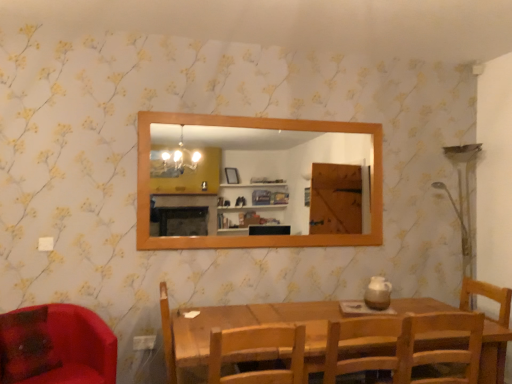
You are a GUI agent. You are given a task and a screenshot of the screen. Output one action in this format:
    pyautogui.click(x=<x>, y=<y>)
    Task: Click on the wooden chair at lower right, which is counted as the fourth chair, starting from the left
    
    Given the screenshot: What is the action you would take?
    pyautogui.click(x=439, y=350)

From the image's perspective, is wooden chair at center, arranged as the third chair when viewed from the right, above or below wooden chair at lower right, which is counted as the fourth chair, starting from the left?

wooden chair at center, arranged as the third chair when viewed from the right, is above wooden chair at lower right, which is counted as the fourth chair, starting from the left.

Are wooden chair at center, arranged as the third chair when viewed from the right, and wooden chair at lower right, which is counted as the fourth chair, starting from the left, making contact?

They are not placed beside each other.

Based on the photo, does wooden chair at center, arranged as the third chair when viewed from the right, have a smaller size compared to wooden chair at lower right, which is counted as the 1th chair, starting from the right?

Indeed, wooden chair at center, arranged as the third chair when viewed from the right, has a smaller size compared to wooden chair at lower right, which is counted as the 1th chair, starting from the right.

From a real-world perspective, is wooden chair at center, arranged as the third chair when viewed from the right, on wooden chair at lower right, which is counted as the fourth chair, starting from the left?

Yes, from a real-world perspective, wooden chair at center, arranged as the third chair when viewed from the right, is on top of wooden chair at lower right, which is counted as the fourth chair, starting from the left.

You are a GUI agent. You are given a task and a screenshot of the screen. Output one action in this format:
    pyautogui.click(x=<x>, y=<y>)
    Task: Click on the 1st chair to the left when counting from the wooden chair at lower right, which is counted as the 1th chair, starting from the right
    The image size is (512, 384).
    Given the screenshot: What is the action you would take?
    pyautogui.click(x=360, y=337)

From a real-world perspective, between wooden chair at center, arranged as the third chair when viewed from the left, and wooden chair at lower right, which is counted as the 1th chair, starting from the right, who is vertically lower?

wooden chair at lower right, which is counted as the 1th chair, starting from the right, from a real-world perspective.

Is the surface of wooden chair at center, arranged as the third chair when viewed from the left, in direct contact with wooden chair at lower right, which is counted as the fourth chair, starting from the left?

No, wooden chair at center, arranged as the third chair when viewed from the left, is not with wooden chair at lower right, which is counted as the fourth chair, starting from the left.

Considering the sizes of objects wooden chair at center, arranged as the 2th chair when viewed from the right, and wooden chair at lower right, which is counted as the fourth chair, starting from the left, in the image provided, who is thinner, wooden chair at center, arranged as the 2th chair when viewed from the right, or wooden chair at lower right, which is counted as the fourth chair, starting from the left,?

With smaller width is wooden chair at lower right, which is counted as the fourth chair, starting from the left.

From a real-world perspective, is wooden chair at lower right, which is counted as the fourth chair, starting from the left, physically located above or below wooden mirror at upper center?

wooden chair at lower right, which is counted as the fourth chair, starting from the left, is situated lower than wooden mirror at upper center in the real world.

Consider the image. Which object is further away from the camera taking this photo, wooden chair at lower right, which is counted as the fourth chair, starting from the left, or wooden mirror at upper center?

Positioned behind is wooden mirror at upper center.

From the image's perspective, who appears lower, wooden chair at center, arranged as the third chair when viewed from the right, or wooden chair at center, arranged as the 2th chair when viewed from the right?

wooden chair at center, arranged as the 2th chair when viewed from the right, appears lower in the image.

Does wooden chair at center, positioned as the second chair in left-to-right order, have a lesser height compared to wooden chair at center, arranged as the third chair when viewed from the left?

Indeed, wooden chair at center, positioned as the second chair in left-to-right order, has a lesser height compared to wooden chair at center, arranged as the third chair when viewed from the left.

Does wooden chair at center, positioned as the second chair in left-to-right order, have a greater width compared to wooden chair at center, arranged as the 2th chair when viewed from the right?

No, wooden chair at center, positioned as the second chair in left-to-right order, is not wider than wooden chair at center, arranged as the 2th chair when viewed from the right.

How many degrees apart are the facing directions of matte red chair at lower left, placed as the 1th chair when sorted from left to right, and wooden chair at center, positioned as the second chair in left-to-right order?

matte red chair at lower left, placed as the 1th chair when sorted from left to right, and wooden chair at center, positioned as the second chair in left-to-right order, are facing 160 degrees away from each other.

Are matte red chair at lower left, which appears as the fourth chair when viewed from the right, and wooden chair at center, arranged as the third chair when viewed from the right, far apart?

matte red chair at lower left, which appears as the fourth chair when viewed from the right, is positioned a significant distance from wooden chair at center, arranged as the third chair when viewed from the right.

Looking at this image, does matte red chair at lower left, placed as the 1th chair when sorted from left to right, have a greater width compared to wooden chair at center, positioned as the second chair in left-to-right order?

Correct, the width of matte red chair at lower left, placed as the 1th chair when sorted from left to right, exceeds that of wooden chair at center, positioned as the second chair in left-to-right order.

Does matte red chair at lower left, placed as the 1th chair when sorted from left to right, lie behind wooden chair at center, positioned as the second chair in left-to-right order?

Yes, matte red chair at lower left, placed as the 1th chair when sorted from left to right, is behind wooden chair at center, positioned as the second chair in left-to-right order.

Is matte red chair at lower left, which appears as the fourth chair when viewed from the right, next to wooden mirror at upper center and touching it?

No, matte red chair at lower left, which appears as the fourth chair when viewed from the right, is not touching wooden mirror at upper center.

Which is in front, matte red chair at lower left, which appears as the fourth chair when viewed from the right, or wooden mirror at upper center?

matte red chair at lower left, which appears as the fourth chair when viewed from the right, is in front.

Considering the sizes of objects matte red chair at lower left, placed as the 1th chair when sorted from left to right, and wooden mirror at upper center in the image provided, who is thinner, matte red chair at lower left, placed as the 1th chair when sorted from left to right, or wooden mirror at upper center?

Thinner between the two is wooden mirror at upper center.

Is wooden mirror at upper center in contact with wooden chair at center, arranged as the third chair when viewed from the left?

No, wooden mirror at upper center is not next to wooden chair at center, arranged as the third chair when viewed from the left.

From a real-world perspective, is wooden mirror at upper center above or below wooden chair at center, arranged as the third chair when viewed from the left?

From a real-world perspective, wooden mirror at upper center is physically above wooden chair at center, arranged as the third chair when viewed from the left.

Identify the location of the 3rd chair in front of the wooden mirror at upper center, starting your count from the anchor. (360, 337).

You are a GUI agent. You are given a task and a screenshot of the screen. Output one action in this format:
    pyautogui.click(x=<x>, y=<y>)
    Task: Click on the 2nd chair positioned above the wooden chair at lower right, which is counted as the fourth chair, starting from the left (from a real-world perspective)
    Image resolution: width=512 pixels, height=384 pixels.
    Given the screenshot: What is the action you would take?
    pyautogui.click(x=258, y=348)

Locate an element on the screen. The image size is (512, 384). chair on the right of wooden chair at center, arranged as the third chair when viewed from the left is located at coordinates (439, 350).

Based on their spatial positions, is matte red chair at lower left, which appears as the fourth chair when viewed from the right, or wooden chair at lower right, which is counted as the 1th chair, starting from the right, further from wooden chair at center, arranged as the third chair when viewed from the left?

Among the two, matte red chair at lower left, which appears as the fourth chair when viewed from the right, is located further to wooden chair at center, arranged as the third chair when viewed from the left.

Consider the image. From the image, which object appears to be farther from wooden chair at center, arranged as the third chair when viewed from the right, wooden mirror at upper center or matte red chair at lower left, which appears as the fourth chair when viewed from the right?

wooden mirror at upper center.

From the picture: Looking at the image, which one is located closer to wooden chair at lower right, which is counted as the fourth chair, starting from the left, wooden chair at center, positioned as the second chair in left-to-right order, or wooden mirror at upper center?

The object closer to wooden chair at lower right, which is counted as the fourth chair, starting from the left, is wooden chair at center, positioned as the second chair in left-to-right order.

Which object lies nearer to the anchor point matte red chair at lower left, placed as the 1th chair when sorted from left to right, wooden chair at center, arranged as the 2th chair when viewed from the right, or wooden chair at lower right, which is counted as the 1th chair, starting from the right?

wooden chair at center, arranged as the 2th chair when viewed from the right, is closer to matte red chair at lower left, placed as the 1th chair when sorted from left to right.

Estimate the real-world distances between objects in this image. Which object is closer to wooden chair at center, arranged as the 2th chair when viewed from the right, wooden chair at center, arranged as the third chair when viewed from the right, or wooden chair at lower right, which is counted as the 1th chair, starting from the right?

wooden chair at lower right, which is counted as the 1th chair, starting from the right, is closer to wooden chair at center, arranged as the 2th chair when viewed from the right.

From the image, which object appears to be nearer to wooden chair at lower right, which is counted as the 1th chair, starting from the right, wooden chair at center, arranged as the 2th chair when viewed from the right, or matte red chair at lower left, placed as the 1th chair when sorted from left to right?

wooden chair at center, arranged as the 2th chair when viewed from the right.

Which object lies further to the anchor point matte red chair at lower left, which appears as the fourth chair when viewed from the right, wooden chair at lower right, which is counted as the fourth chair, starting from the left, or wooden chair at center, arranged as the third chair when viewed from the left?

The object further to matte red chair at lower left, which appears as the fourth chair when viewed from the right, is wooden chair at lower right, which is counted as the fourth chair, starting from the left.

When comparing their distances from matte red chair at lower left, which appears as the fourth chair when viewed from the right, does wooden chair at lower right, which is counted as the 1th chair, starting from the right, or wooden mirror at upper center seem further?

Based on the image, wooden mirror at upper center appears to be further to matte red chair at lower left, which appears as the fourth chair when viewed from the right.

This screenshot has width=512, height=384. I want to click on chair located between matte red chair at lower left, which appears as the fourth chair when viewed from the right, and wooden chair at center, arranged as the third chair when viewed from the left, in the left-right direction, so click(x=258, y=348).

The image size is (512, 384). Find the location of `mirror between matte red chair at lower left, which appears as the fourth chair when viewed from the right, and wooden chair at lower right, which is counted as the 1th chair, starting from the right, from left to right`. mirror between matte red chair at lower left, which appears as the fourth chair when viewed from the right, and wooden chair at lower right, which is counted as the 1th chair, starting from the right, from left to right is located at coordinates (256, 181).

Locate an element on the screen. Image resolution: width=512 pixels, height=384 pixels. mirror between matte red chair at lower left, which appears as the fourth chair when viewed from the right, and wooden chair at center, arranged as the 2th chair when viewed from the right, from left to right is located at coordinates (256, 181).

Locate an element on the screen. This screenshot has height=384, width=512. chair between matte red chair at lower left, placed as the 1th chair when sorted from left to right, and wooden mirror at upper center, in the horizontal direction is located at coordinates (258, 348).